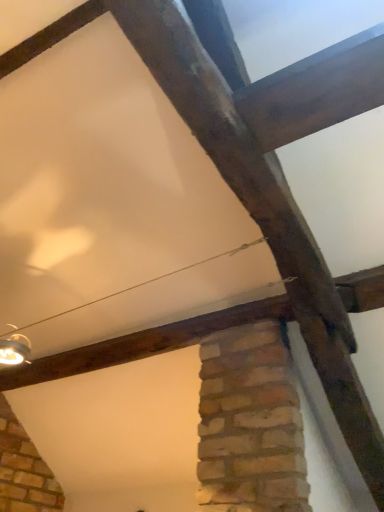
Where is `metallic silver lamp at lower left`? Image resolution: width=384 pixels, height=512 pixels. metallic silver lamp at lower left is located at coordinates (14, 350).

The image size is (384, 512). What do you see at coordinates (14, 350) in the screenshot? I see `metallic silver lamp at lower left` at bounding box center [14, 350].

Find the location of a particular element. The height and width of the screenshot is (512, 384). metallic silver lamp at lower left is located at coordinates (14, 350).